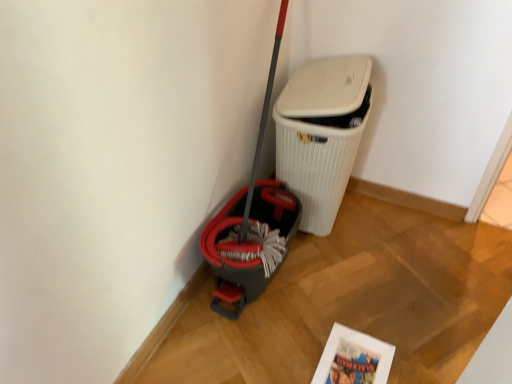
Where is `white textured waste bin at center`? Image resolution: width=512 pixels, height=384 pixels. white textured waste bin at center is located at coordinates (321, 133).

The width and height of the screenshot is (512, 384). Describe the element at coordinates (321, 133) in the screenshot. I see `white textured waste bin at center` at that location.

The image size is (512, 384). I want to click on matte white comic book at lower center, so click(353, 358).

Image resolution: width=512 pixels, height=384 pixels. Describe the element at coordinates (353, 358) in the screenshot. I see `matte white comic book at lower center` at that location.

Where is `white textured waste bin at center`? The height and width of the screenshot is (384, 512). white textured waste bin at center is located at coordinates (321, 133).

Would you say white textured waste bin at center is to the left or to the right of matte white comic book at lower center in the picture?

white textured waste bin at center is to the left of matte white comic book at lower center.

In the image, is white textured waste bin at center positioned in front of or behind matte white comic book at lower center?

In the image, white textured waste bin at center appears behind matte white comic book at lower center.

Is point (340, 104) positioned behind point (328, 352)?

Yes, it is behind point (328, 352).

From the image's perspective, is white textured waste bin at center located beneath matte white comic book at lower center?

No, from the image's perspective, white textured waste bin at center is not beneath matte white comic book at lower center.

From a real-world perspective, is white textured waste bin at center physically located above or below matte white comic book at lower center?

white textured waste bin at center is situated higher than matte white comic book at lower center in the real world.

Which object is wider, white textured waste bin at center or matte white comic book at lower center?

white textured waste bin at center is wider.

In terms of height, does white textured waste bin at center look taller or shorter compared to matte white comic book at lower center?

In the image, white textured waste bin at center appears to be taller than matte white comic book at lower center.

Is white textured waste bin at center bigger than matte white comic book at lower center?

Yes.

Is white textured waste bin at center inside the boundaries of matte white comic book at lower center, or outside?

white textured waste bin at center lies outside matte white comic book at lower center.

From the picture: Is white textured waste bin at center not near matte white comic book at lower center?

Actually, white textured waste bin at center and matte white comic book at lower center are a little close together.

Is white textured waste bin at center looking in the opposite direction of matte white comic book at lower center?

white textured waste bin at center is not turned away from matte white comic book at lower center.

Measure the distance from white textured waste bin at center to matte white comic book at lower center.

white textured waste bin at center and matte white comic book at lower center are 26.29 inches apart.

Locate an element on the screen. The width and height of the screenshot is (512, 384). comic book below the white textured waste bin at center (from a real-world perspective) is located at coordinates (353, 358).

Is matte white comic book at lower center to the left of white textured waste bin at center from the viewer's perspective?

In fact, matte white comic book at lower center is to the right of white textured waste bin at center.

Considering the positions of objects matte white comic book at lower center and white textured waste bin at center in the image provided, who is in front, matte white comic book at lower center or white textured waste bin at center?

matte white comic book at lower center is in front.

Does point (361, 352) come farther from viewer compared to point (309, 113)?

No.

From the image's perspective, is matte white comic book at lower center on white textured waste bin at center?

No, from the image's perspective, matte white comic book at lower center is not on top of white textured waste bin at center.

From a real-world perspective, does matte white comic book at lower center stand above white textured waste bin at center?

No, from a real-world perspective, matte white comic book at lower center is not over white textured waste bin at center

Which of these two, matte white comic book at lower center or white textured waste bin at center, is thinner?

Thinner between the two is matte white comic book at lower center.

Who is taller, matte white comic book at lower center or white textured waste bin at center?

With more height is white textured waste bin at center.

Does matte white comic book at lower center have a larger size compared to white textured waste bin at center?

Actually, matte white comic book at lower center might be smaller than white textured waste bin at center.

Is white textured waste bin at center located within matte white comic book at lower center?

No, white textured waste bin at center is not a part of matte white comic book at lower center.

Is matte white comic book at lower center positioned far away from white textured waste bin at center?

They are positioned close to each other.

Is matte white comic book at lower center oriented away from white textured waste bin at center?

matte white comic book at lower center does not have its back to white textured waste bin at center.

This screenshot has width=512, height=384. I want to click on comic book below the white textured waste bin at center (from the image's perspective), so click(x=353, y=358).

Find the location of a particular element. The image size is (512, 384). waste container above the matte white comic book at lower center (from the image's perspective) is located at coordinates (321, 133).

Image resolution: width=512 pixels, height=384 pixels. Identify the location of comic book lying below the white textured waste bin at center (from the image's perspective). (353, 358).